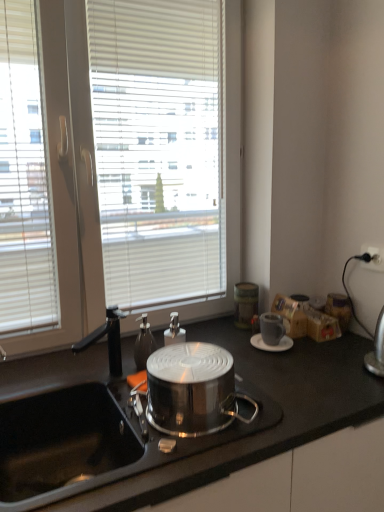
This screenshot has height=512, width=384. What do you see at coordinates (174, 331) in the screenshot? I see `translucent glass soap dispenser at center` at bounding box center [174, 331].

Identify the location of matte gray cup at right. The image size is (384, 512). (271, 328).

What do you see at coordinates (157, 433) in the screenshot? This screenshot has width=384, height=512. I see `black matte countertop at center` at bounding box center [157, 433].

Describe the element at coordinates (339, 309) in the screenshot. I see `wooden spice rack at right` at that location.

The image size is (384, 512). Describe the element at coordinates (193, 390) in the screenshot. I see `shiny metallic pot at center` at that location.

Find the location of `translucent glass soap dispenser at center`. translucent glass soap dispenser at center is located at coordinates (174, 331).

Are black matte countertop at center and white matte saucer at right far apart?

No, there isn't a large distance between black matte countertop at center and white matte saucer at right.

Is black matte countertop at center looking in the opposite direction of white matte saucer at right?

No, white matte saucer at right is not at the back of black matte countertop at center.

Between black matte countertop at center and white matte saucer at right, which one is positioned behind?

white matte saucer at right is more distant.

Which object is wider, black matte countertop at center or white matte saucer at right?

black matte countertop at center.

Based on the photo, considering the sizes of objects shiny metallic pot at center and matte gray cup at right in the image provided, who is smaller, shiny metallic pot at center or matte gray cup at right?

matte gray cup at right.

Who is taller, shiny metallic pot at center or matte gray cup at right?

shiny metallic pot at center is taller.

Is matte gray cup at right surrounded by shiny metallic pot at center?

That's incorrect, matte gray cup at right is not inside shiny metallic pot at center.

Looking at this image, considering the positions of objects shiny metallic pot at center and matte gray cup at right in the image provided, who is behind, shiny metallic pot at center or matte gray cup at right?

matte gray cup at right is further from the camera.

Is translucent glass soap dispenser at center at the left side of white matte saucer at right?

Indeed, translucent glass soap dispenser at center is positioned on the left side of white matte saucer at right.

Does translucent glass soap dispenser at center touch white matte saucer at right?

translucent glass soap dispenser at center and white matte saucer at right are not in contact.

Considering the sizes of translucent glass soap dispenser at center and white matte saucer at right in the image, is translucent glass soap dispenser at center wider or thinner than white matte saucer at right?

Clearly, translucent glass soap dispenser at center has less width compared to white matte saucer at right.

Is point (177, 342) closer or farther from the camera than point (292, 340)?

Point (177, 342) is positioned closer to the camera compared to point (292, 340).

Which object is positioned more to the left, wooden spice rack at right or white matte saucer at right?

white matte saucer at right.

How different are the orientations of wooden spice rack at right and white matte saucer at right in degrees?

The angular difference between wooden spice rack at right and white matte saucer at right is 9.26 degrees.

From a real-world perspective, is wooden spice rack at right on white matte saucer at right?

Indeed, from a real-world perspective, wooden spice rack at right stands above white matte saucer at right.

Does point (163, 402) appear closer or farther from the camera than point (271, 350)?

Clearly, point (163, 402) is closer to the camera than point (271, 350).

How many degrees apart are the facing directions of shiny metallic pot at center and white matte saucer at right?

The angular difference between shiny metallic pot at center and white matte saucer at right is 9.45 degrees.

Which is in front, shiny metallic pot at center or white matte saucer at right?

Positioned in front is shiny metallic pot at center.

From the picture: Considering the sizes of objects shiny metallic pot at center and white matte saucer at right in the image provided, who is taller, shiny metallic pot at center or white matte saucer at right?

shiny metallic pot at center is taller.

From the image's perspective, which one is positioned higher, wooden spice rack at right or white plastic power outlet at upper right?

white plastic power outlet at upper right appears higher in the image.

Considering the positions of point (334, 309) and point (367, 249), is point (334, 309) closer or farther from the camera than point (367, 249)?

Point (334, 309) is positioned farther from the camera compared to point (367, 249).

Does wooden spice rack at right have a greater height compared to white plastic power outlet at upper right?

Yes, wooden spice rack at right is taller than white plastic power outlet at upper right.

Looking at this image, is wooden spice rack at right positioned behind white plastic power outlet at upper right?

Yes, it is.

Is the surface of white matte saucer at right in direct contact with black matte countertop at center?

They are not placed beside each other.

Which object is more forward, white matte saucer at right or black matte countertop at center?

black matte countertop at center is more forward.

Can you confirm if white matte saucer at right is positioned to the right of black matte countertop at center?

Indeed, white matte saucer at right is positioned on the right side of black matte countertop at center.

Identify the location of saucer on the right of black matte countertop at center. The width and height of the screenshot is (384, 512). (270, 345).

You are a GUI agent. You are given a task and a screenshot of the screen. Output one action in this format:
    pyautogui.click(x=<x>, y=<y>)
    Task: Click on the kitchen appliance on the left side of matte gray cup at right
    Image resolution: width=384 pixels, height=512 pixels.
    Given the screenshot: What is the action you would take?
    pyautogui.click(x=193, y=390)

Considering their positions, is black matte countertop at center positioned closer to matte gray cup at right than translucent glass soap dispenser at center?

Based on the image, translucent glass soap dispenser at center appears to be nearer to matte gray cup at right.

Considering their positions, is wooden spice rack at right positioned further to shiny metallic pot at center than black matte countertop at center?

wooden spice rack at right lies further to shiny metallic pot at center than the other object.

Considering their positions, is white plastic power outlet at upper right positioned closer to wooden spice rack at right than shiny metallic pot at center?

Based on the image, white plastic power outlet at upper right appears to be nearer to wooden spice rack at right.

Looking at the image, which one is located further to white plastic power outlet at upper right, white matte saucer at right or shiny metallic pot at center?

The object further to white plastic power outlet at upper right is shiny metallic pot at center.

Considering their positions, is shiny metallic pot at center positioned closer to translucent glass soap dispenser at center than white plastic power outlet at upper right?

Among the two, shiny metallic pot at center is located nearer to translucent glass soap dispenser at center.

Estimate the real-world distances between objects in this image. Which object is further from translucent glass soap dispenser at center, matte gray cup at right or white plastic power outlet at upper right?

Among the two, white plastic power outlet at upper right is located further to translucent glass soap dispenser at center.

Based on their spatial positions, is translucent glass soap dispenser at center or wooden spice rack at right further from black matte countertop at center?

wooden spice rack at right is further to black matte countertop at center.

Considering their positions, is black matte countertop at center positioned closer to white plastic power outlet at upper right than wooden spice rack at right?

wooden spice rack at right.

Locate an element on the screen. The height and width of the screenshot is (512, 384). bottle between black matte countertop at center and white plastic power outlet at upper right from front to back is located at coordinates (174, 331).

Locate an element on the screen. This screenshot has width=384, height=512. coffee cup located between white matte saucer at right and wooden spice rack at right in the left-right direction is located at coordinates (271, 328).

Locate an element on the screen. This screenshot has height=512, width=384. power outlet positioned between shiny metallic pot at center and wooden spice rack at right from near to far is located at coordinates pyautogui.click(x=373, y=255).

Where is `bottle between black matte countertop at center and white matte saucer at right from front to back`? Image resolution: width=384 pixels, height=512 pixels. bottle between black matte countertop at center and white matte saucer at right from front to back is located at coordinates (174, 331).